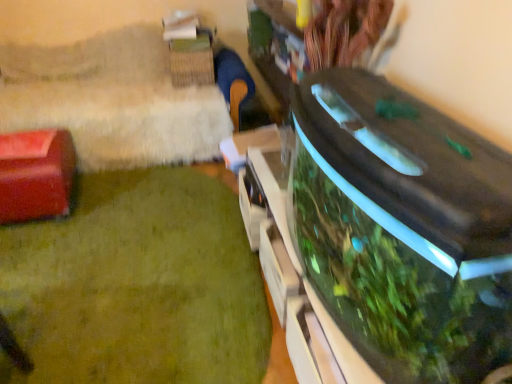
At what (x,y) coordinates should I click in order to perform the action: click on transparent glass aquarium at right. Please return your answer as a coordinate pair (x, y). Looking at the image, I should click on (380, 281).

What is the approximate height of transparent glass aquarium at right?

transparent glass aquarium at right is 13.29 inches tall.

The height and width of the screenshot is (384, 512). What do you see at coordinates (137, 286) in the screenshot? I see `green glossy aquarium at lower right` at bounding box center [137, 286].

The image size is (512, 384). I want to click on matte red box at left, so click(x=35, y=175).

Which point is more forward, (395, 312) or (134, 207)?

The point (395, 312) is in front.

This screenshot has width=512, height=384. I want to click on vegetation located above the green glossy aquarium at lower right (from the image's perspective), so click(380, 281).

Based on the photo, how different are the orientations of transparent glass aquarium at right and green glossy aquarium at lower right in degrees?

89.8 degrees.

From a real-world perspective, is green glossy aquarium at lower right located higher than transparent glass aquarium at right?

Incorrect, from a real-world perspective, green glossy aquarium at lower right is lower than transparent glass aquarium at right.

Measure the distance from green glossy aquarium at lower right to transparent glass aquarium at right.

green glossy aquarium at lower right is 26.65 inches away from transparent glass aquarium at right.

Who is shorter, green glossy aquarium at lower right or transparent glass aquarium at right?

green glossy aquarium at lower right.

Does green glossy aquarium at lower right come in front of transparent glass aquarium at right?

No, it is not.

Consider the image. Considering the sizes of transparent glass aquarium at right and matte red box at left in the image, is transparent glass aquarium at right wider or thinner than matte red box at left?

In the image, transparent glass aquarium at right appears to be more narrow than matte red box at left.

Is transparent glass aquarium at right far from matte red box at left?

transparent glass aquarium at right is far away from matte red box at left.

Is matte red box at left beside green glossy aquarium at lower right?

No, matte red box at left is not making contact with green glossy aquarium at lower right.

Who is taller, matte red box at left or green glossy aquarium at lower right?

With more height is matte red box at left.

I want to click on furniture above the green glossy aquarium at lower right (from a real-world perspective), so click(35, 175).

Based on the photo, is matte red box at left spatially inside green glossy aquarium at lower right, or outside of it?

matte red box at left is outside green glossy aquarium at lower right.

Which of these two, matte red box at left or transparent glass aquarium at right, is thinner?

Thinner between the two is transparent glass aquarium at right.

Is matte red box at left oriented away from transparent glass aquarium at right?

No, matte red box at left is not facing away from transparent glass aquarium at right.

Is matte red box at left not close to transparent glass aquarium at right?

matte red box at left is far away from transparent glass aquarium at right.

Is matte red box at left not inside transparent glass aquarium at right?

Indeed, matte red box at left is completely outside transparent glass aquarium at right.

Consider the image. Considering the sizes of objects green glossy aquarium at lower right and matte red box at left in the image provided, who is shorter, green glossy aquarium at lower right or matte red box at left?

green glossy aquarium at lower right is shorter.

Considering the positions of objects green glossy aquarium at lower right and matte red box at left in the image provided, who is in front, green glossy aquarium at lower right or matte red box at left?

green glossy aquarium at lower right.

Is matte red box at left located within green glossy aquarium at lower right?

No.

Locate an element on the screen. Image resolution: width=512 pixels, height=384 pixels. vegetation located above the green glossy aquarium at lower right (from a real-world perspective) is located at coordinates (380, 281).

Locate an element on the screen. Image resolution: width=512 pixels, height=384 pixels. vegetation on the right of green glossy aquarium at lower right is located at coordinates (380, 281).

From the image, which object appears to be nearer to transparent glass aquarium at right, green glossy aquarium at lower right or matte red box at left?

green glossy aquarium at lower right lies closer to transparent glass aquarium at right than the other object.

When comparing their distances from transparent glass aquarium at right, does matte red box at left or green glossy aquarium at lower right seem closer?

Based on the image, green glossy aquarium at lower right appears to be nearer to transparent glass aquarium at right.

From the image, which object appears to be nearer to matte red box at left, green glossy aquarium at lower right or transparent glass aquarium at right?

Among the two, green glossy aquarium at lower right is located nearer to matte red box at left.

Considering their positions, is transparent glass aquarium at right positioned further to green glossy aquarium at lower right than matte red box at left?

transparent glass aquarium at right is positioned further to the anchor green glossy aquarium at lower right.

Looking at the image, which one is located closer to green glossy aquarium at lower right, matte red box at left or transparent glass aquarium at right?

matte red box at left.

Considering their positions, is transparent glass aquarium at right positioned further to matte red box at left than green glossy aquarium at lower right?

Based on the image, transparent glass aquarium at right appears to be further to matte red box at left.

At what (x,y) coordinates should I click in order to perform the action: click on plant located between matte red box at left and transparent glass aquarium at right in the left-right direction. Please return your answer as a coordinate pair (x, y). Looking at the image, I should click on pyautogui.click(x=137, y=286).